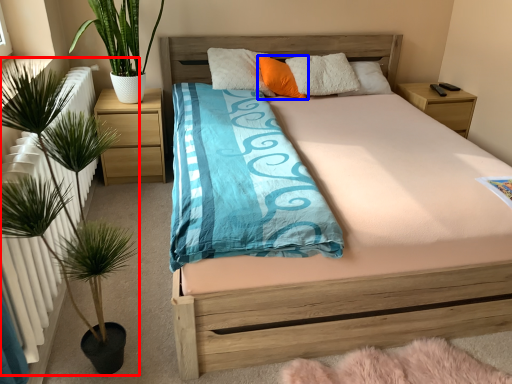
Question: Among these objects, which one is nearest to the camera, houseplant (highlighted by a red box) or pillow (highlighted by a blue box)?

Choices:
 (A) houseplant
 (B) pillow

Answer: (A)